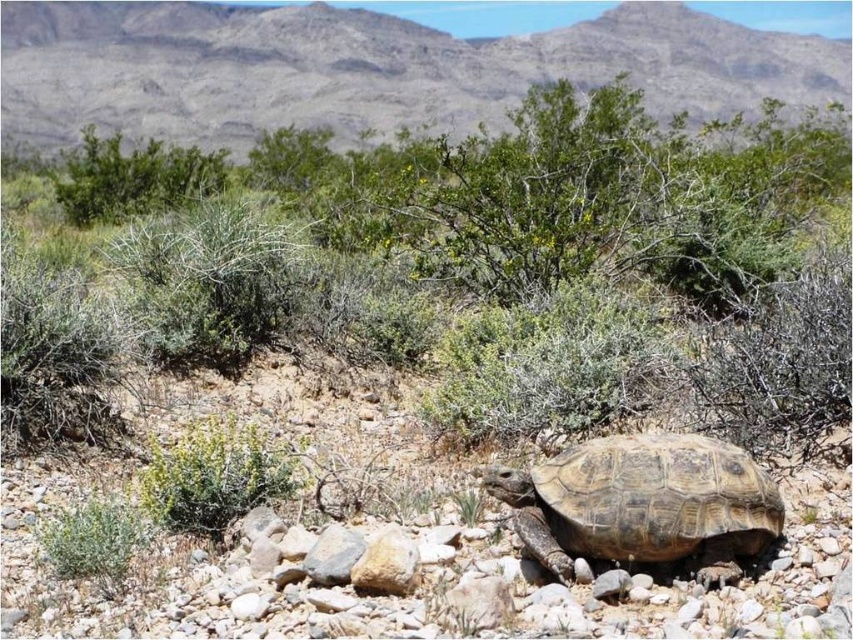
Question: Is green shrubs at center wider than green leafy bush at center?

Choices:
 (A) yes
 (B) no

Answer: (A)

Question: Estimate the real-world distances between objects in this image. Which object is farther from the green shrubs at center?

Choices:
 (A) green leafy bush at center
 (B) brown textured tortoise at center

Answer: (A)

Question: Is green shrubs at center bigger than green leafy bush at center?

Choices:
 (A) yes
 (B) no

Answer: (A)

Question: Which object is the farthest from the green leafy bush at center?

Choices:
 (A) brown textured tortoise at center
 (B) green shrubs at center

Answer: (B)

Question: Does green shrubs at center appear on the left side of brown textured tortoise at center?

Choices:
 (A) yes
 (B) no

Answer: (B)

Question: Which point is farther to the camera?

Choices:
 (A) green shrubs at center
 (B) green leafy bush at center
 (C) brown textured tortoise at center

Answer: (A)